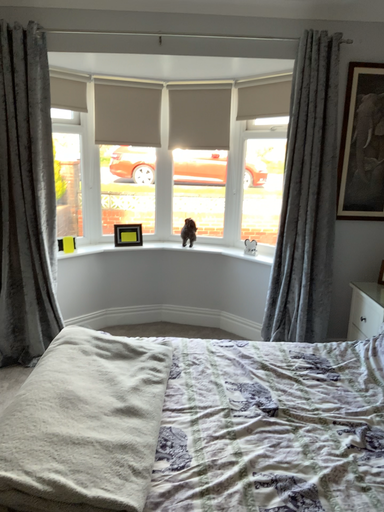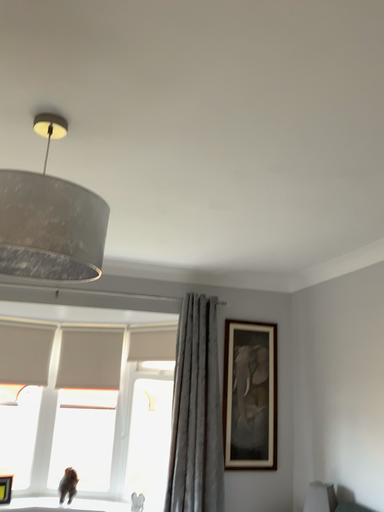
Question: How did the camera likely rotate when shooting the video?

Choices:
 (A) rotated right
 (B) rotated left

Answer: (A)